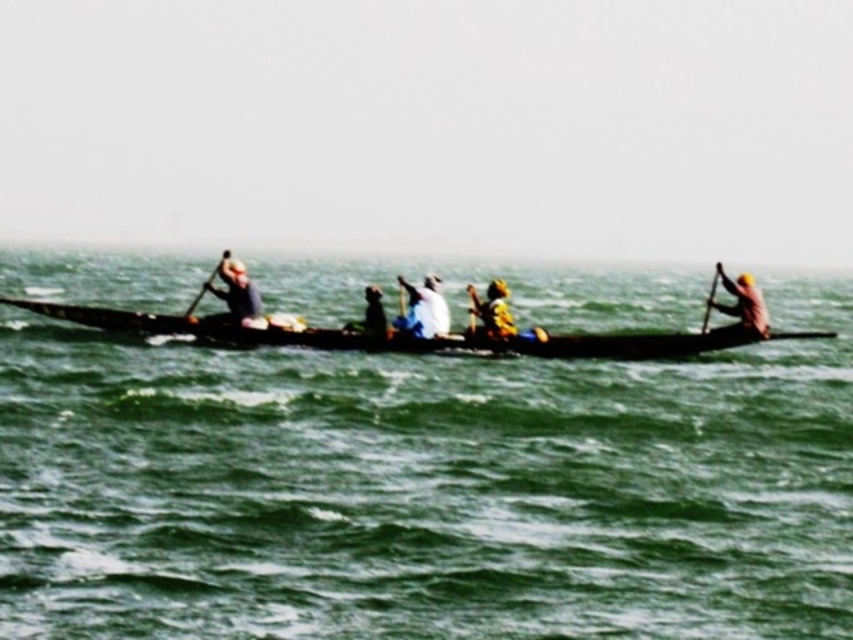
You are standing on the shore and want to determine if the green water at center is wider than the matte black shirt at center. Can you confirm this based on the scene?

The green water at center has a larger width than the matte black shirt at center, so yes, the green water at center is wider than the matte black shirt at center.

You are standing on the shore observing the green water at center and the matte black shirt at center. Which one takes up more space in the image?

The green water at center is larger in size than the matte black shirt at center, so the green water at center takes up more space in the image.